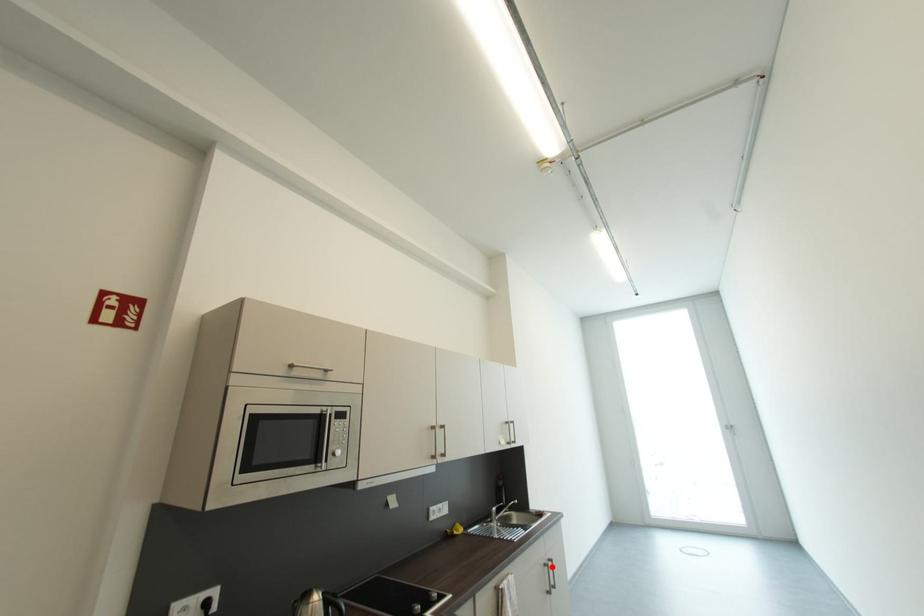
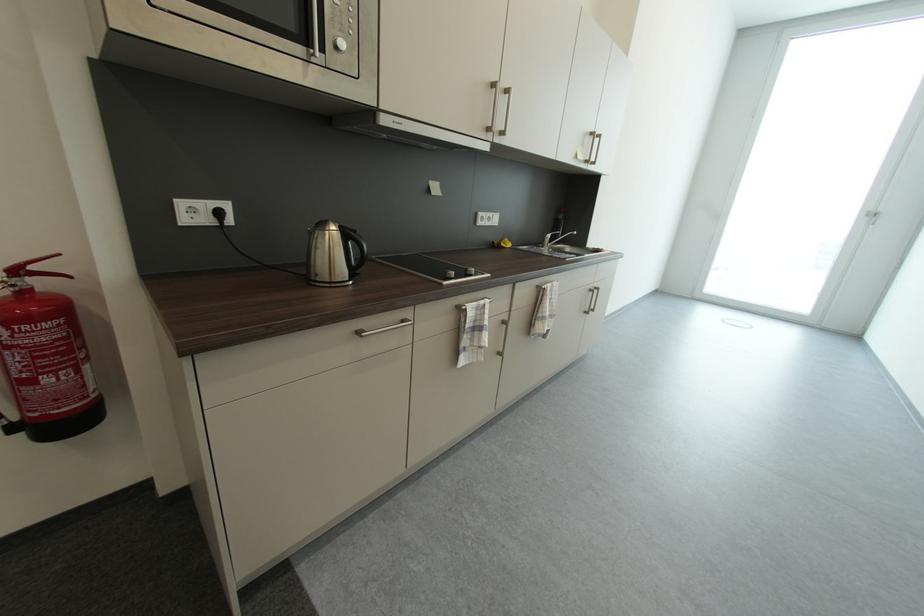
In the second image, find the point that corresponds to the highlighted location in the first image.

(598, 292)